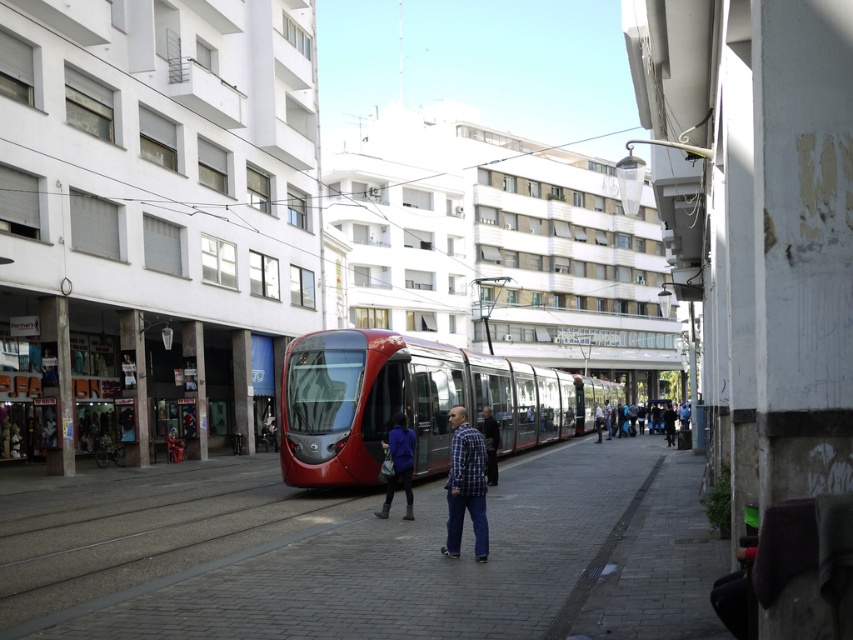
I want to click on dark blue plaid shirt at center, so click(490, 444).

Who is higher up, dark blue plaid shirt at center or blue denim jeans at center?

dark blue plaid shirt at center

You are a GUI agent. You are given a task and a screenshot of the screen. Output one action in this format:
    pyautogui.click(x=<x>, y=<y>)
    Task: Click on the dark blue plaid shirt at center
    The image size is (853, 640).
    Given the screenshot: What is the action you would take?
    pyautogui.click(x=490, y=444)

Does plaid shirt at center have a greater width compared to dark blue plaid shirt at center?

Indeed, plaid shirt at center has a greater width compared to dark blue plaid shirt at center.

Can you confirm if plaid shirt at center is thinner than dark blue plaid shirt at center?

In fact, plaid shirt at center might be wider than dark blue plaid shirt at center.

Which is behind, point (463, 412) or point (490, 444)?

The point (490, 444) is behind.

Locate an element on the screen. Image resolution: width=853 pixels, height=640 pixels. plaid shirt at center is located at coordinates (465, 484).

Can you confirm if shiny red tram at center is smaller than plaid shirt at center?

Actually, shiny red tram at center might be larger than plaid shirt at center.

Which is in front, point (358, 376) or point (474, 461)?

Positioned in front is point (474, 461).

Does point (283, 445) lie behind point (456, 474)?

Yes, point (283, 445) is behind point (456, 474).

At what (x,y) coordinates should I click in order to perform the action: click on shiny red tram at center. Please return your answer as a coordinate pair (x, y). The height and width of the screenshot is (640, 853). Looking at the image, I should click on (410, 403).